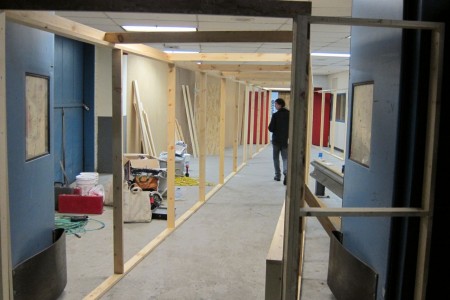
At what (x,y) coordinates should I click in order to perform the action: click on ceiling light. Please return your answer as a coordinate pair (x, y). Looking at the image, I should click on (329, 53), (155, 29), (176, 55).